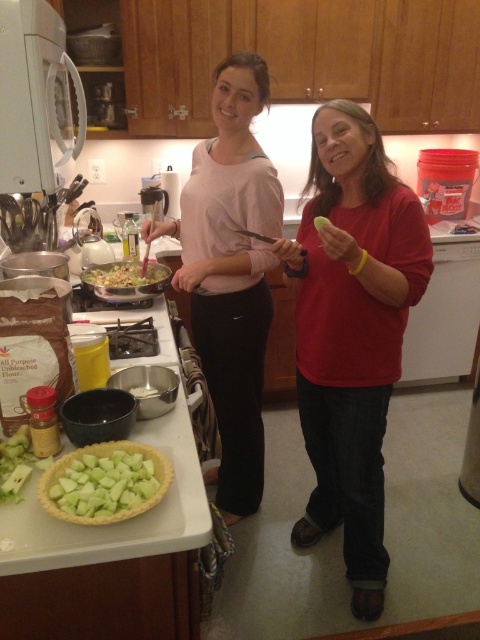
Is matte red shirt at center closer to the viewer compared to matte pink shirt at center?

Yes, it is.

Can you confirm if matte red shirt at center is shorter than matte pink shirt at center?

Yes, matte red shirt at center is shorter than matte pink shirt at center.

The height and width of the screenshot is (640, 480). I want to click on matte red shirt at center, so click(x=351, y=332).

Is matte pink shirt at center smaller than shiny plastic salad bowl at center?

Actually, matte pink shirt at center might be larger than shiny plastic salad bowl at center.

What do you see at coordinates (230, 273) in the screenshot? I see `matte pink shirt at center` at bounding box center [230, 273].

This screenshot has height=640, width=480. In order to click on matte pink shirt at center in this screenshot , I will do `click(230, 273)`.

Can you confirm if matte red shirt at center is smaller than shiny plastic salad bowl at center?

No, matte red shirt at center is not smaller than shiny plastic salad bowl at center.

Is point (392, 243) positioned in front of point (95, 269)?

Yes, point (392, 243) is in front of point (95, 269).

You are a GUI agent. You are given a task and a screenshot of the screen. Output one action in this format:
    pyautogui.click(x=<x>, y=<y>)
    Task: Click on the matte red shirt at center
    Image resolution: width=480 pixels, height=640 pixels.
    Given the screenshot: What is the action you would take?
    (351, 332)